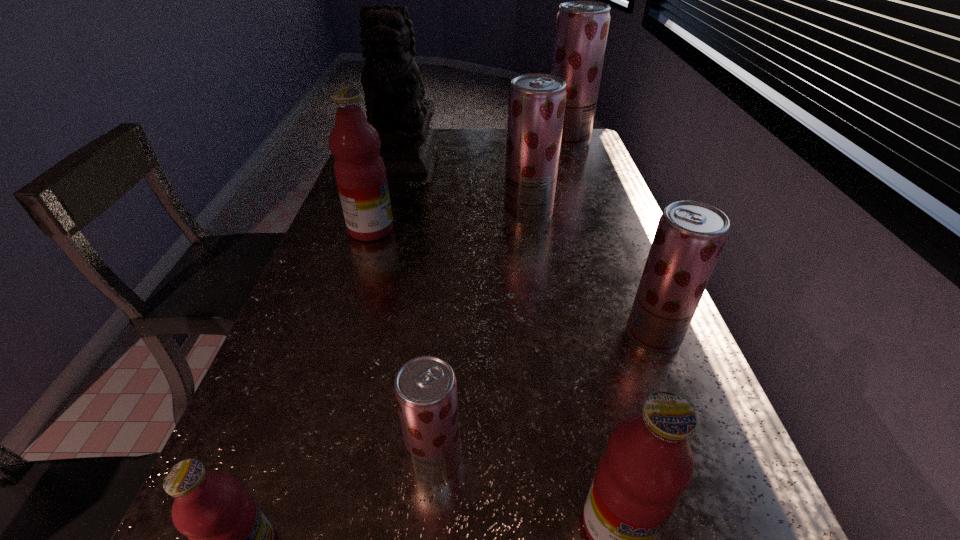
Identify the location of free point located on the front-facing side of the sculpture. (383, 234).

Locate an element on the screen. blank area located 0.260m on the left of the farthest fruit juice is located at coordinates (475, 141).

What are the coordinates of `free location located 0.190m on the left of the third strawberry fruit juice from right to left` in the screenshot? It's located at coord(439,214).

Locate an element on the screen. The image size is (960, 540). blank space located 0.330m on the label of the farthest pink fruit juice is located at coordinates (513, 230).

The height and width of the screenshot is (540, 960). In order to click on free location located on the front of the fourth nearest fruit juice in this screenshot , I will do `click(676, 394)`.

At what (x,y) coordinates should I click in order to perform the action: click on vacant space located 0.180m on the left of the leftmost strawberry fruit juice. Please return your answer as a coordinate pair (x, y). The width and height of the screenshot is (960, 540). Looking at the image, I should click on (300, 461).

You are a GUI agent. You are given a task and a screenshot of the screen. Output one action in this format:
    pyautogui.click(x=<x>, y=<y>)
    Task: Click on the sculpture located at the far edge
    Image resolution: width=960 pixels, height=540 pixels.
    Given the screenshot: What is the action you would take?
    pos(393,88)

This screenshot has width=960, height=540. I want to click on fruit juice situated at the far edge, so click(582, 27).

At what (x,y) coordinates should I click in order to perform the action: click on sculpture at the left edge. Please return your answer as a coordinate pair (x, y). The width and height of the screenshot is (960, 540). Looking at the image, I should click on (393, 88).

I want to click on fruit juice situated at the left edge, so click(360, 173).